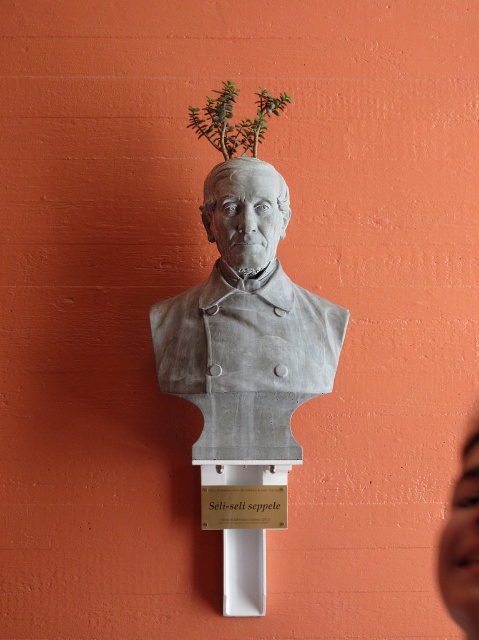
Can you confirm if green leafy plant at upper center is positioned to the left of matte white sign at center?

Correct, you'll find green leafy plant at upper center to the left of matte white sign at center.

Which is in front, point (244, 132) or point (226, 506)?

Point (244, 132)

You are a GUI agent. You are given a task and a screenshot of the screen. Output one action in this format:
    pyautogui.click(x=<x>, y=<y>)
    Task: Click on the green leafy plant at upper center
    The height and width of the screenshot is (640, 479).
    Given the screenshot: What is the action you would take?
    pyautogui.click(x=237, y=122)

Who is more forward, [217,444] or [467,456]?

Point [467,456]

Does point (205, 284) come farther from viewer compared to point (477, 561)?

Yes, it is.

This screenshot has height=640, width=479. What are the coordinates of `gray stone bust at center` in the screenshot? It's located at (247, 324).

Image resolution: width=479 pixels, height=640 pixels. Identify the location of gray stone bust at center. (247, 324).

Which of these two, gray stone bust at center or matte white sign at center, stands taller?

gray stone bust at center is taller.

Find the location of a particular element. This screenshot has width=479, height=640. gray stone bust at center is located at coordinates (247, 324).